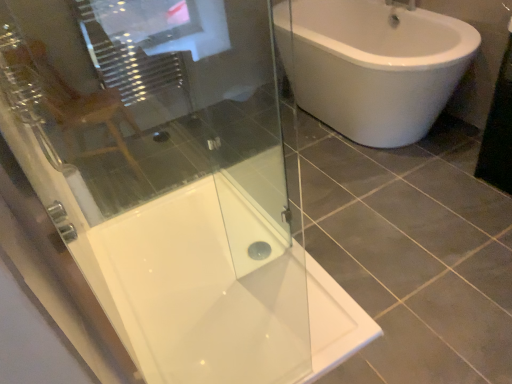
Question: Is matte wooden chair at upper left inside or outside of transparent glass shower door at upper left?

Choices:
 (A) outside
 (B) inside

Answer: (A)

Question: Would you say matte wooden chair at upper left is to the left or to the right of transparent glass shower door at upper left in the picture?

Choices:
 (A) left
 (B) right

Answer: (A)

Question: Estimate the real-world distances between objects in this image. Which object is farther from the transparent glass shower door at upper left?

Choices:
 (A) matte wooden chair at upper left
 (B) white glossy shower tray at center

Answer: (A)

Question: Which object is the closest to the transparent glass shower door at upper left?

Choices:
 (A) white glossy shower tray at center
 (B) matte wooden chair at upper left

Answer: (A)